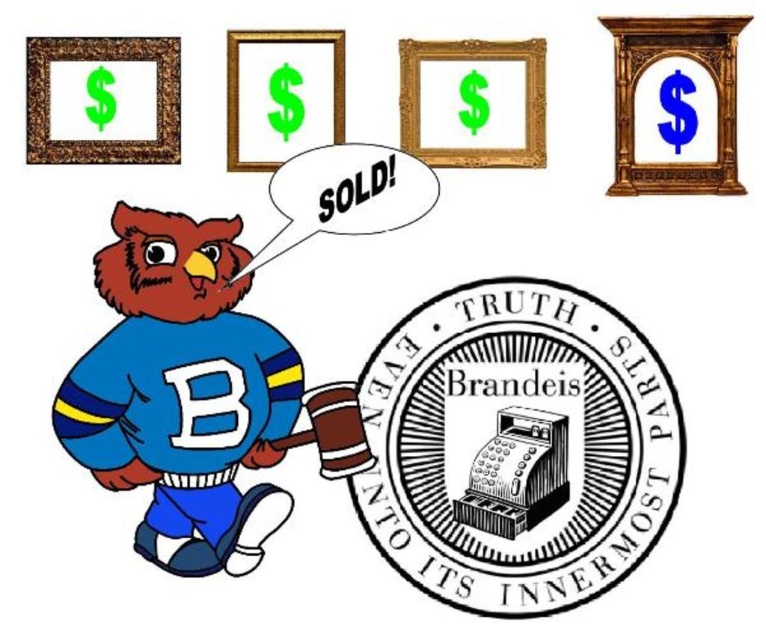
Question: Which object is closer to the camera taking this photo?

Choices:
 (A) gold wooden frame at upper right
 (B) matte blue jersey at lower left

Answer: (A)

Question: Can you confirm if matte blue jersey at lower left is bigger than black paper at upper center?

Choices:
 (A) yes
 (B) no

Answer: (A)

Question: Which of the following is the farthest from the observer?

Choices:
 (A) gold/golden frame at upper center
 (B) gold wooden frame at upper right
 (C) black paper at upper center
 (D) matte blue jersey at lower left

Answer: (C)

Question: Which point is farther to the camera?

Choices:
 (A) gold wooden frame at upper right
 (B) matte blue jersey at lower left

Answer: (B)

Question: Is black/white/ink cash register at center below gold wooden frame at upper right?

Choices:
 (A) yes
 (B) no

Answer: (A)

Question: Can you confirm if matte blue jersey at lower left is positioned above gold wooden frame at upper right?

Choices:
 (A) yes
 (B) no

Answer: (B)